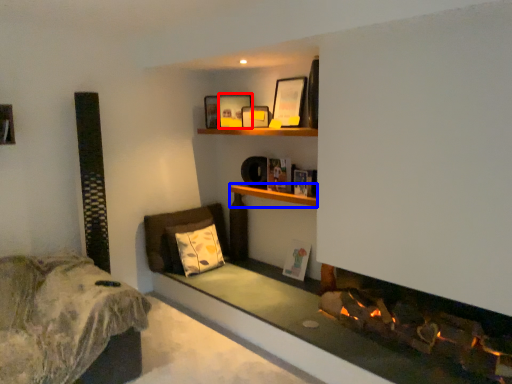
Question: Which point is further to the camera, picture frame (highlighted by a red box) or cabinet (highlighted by a blue box)?

Choices:
 (A) picture frame
 (B) cabinet

Answer: (A)